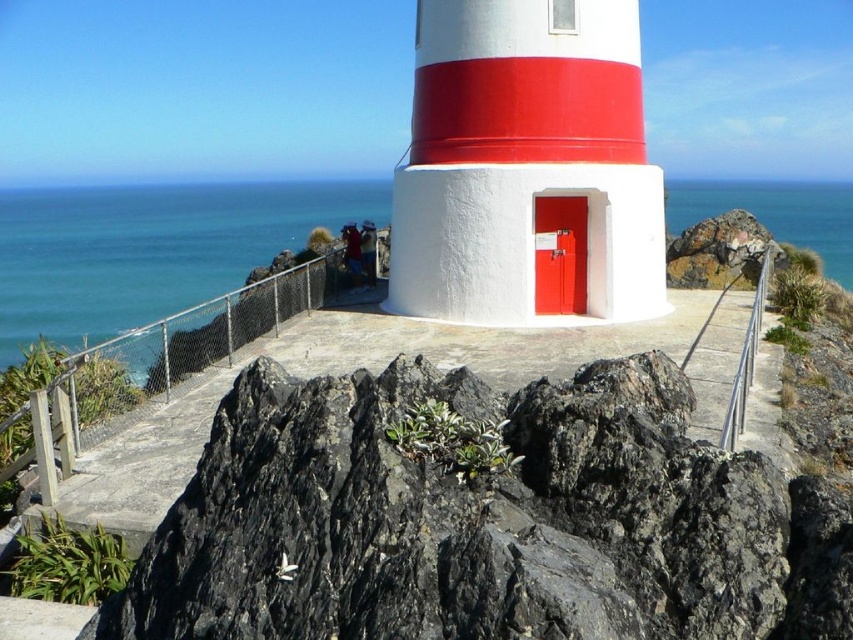
Question: Does black rock at center have a smaller size compared to blue water at upper center?

Choices:
 (A) yes
 (B) no

Answer: (A)

Question: Among these points, which one is farthest from the camera?

Choices:
 (A) pos(817,205)
 (B) pos(618,522)

Answer: (A)

Question: Does black rock at center appear on the right side of blue water at upper center?

Choices:
 (A) yes
 (B) no

Answer: (B)

Question: Among these objects, which one is farthest from the camera?

Choices:
 (A) blue water at upper center
 (B) black rock at center

Answer: (A)

Question: Is black rock at center to the left of blue water at upper center from the viewer's perspective?

Choices:
 (A) no
 (B) yes

Answer: (B)